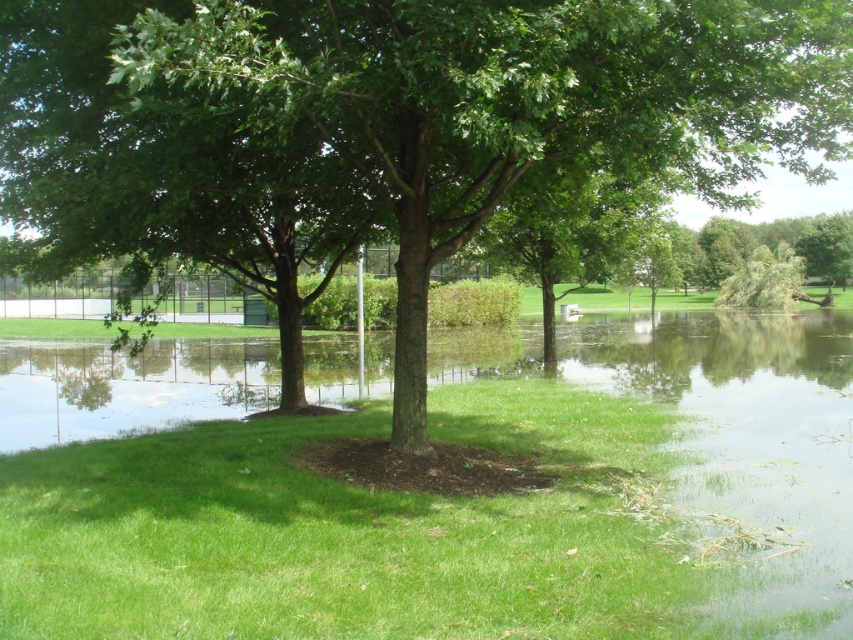
Which is above, green leafy tree at center or green leafy tree at right?

green leafy tree at right

Who is shorter, green leafy tree at center or green leafy tree at right?

Standing shorter between the two is green leafy tree at center.

Is point (752, 154) closer to viewer compared to point (837, 260)?

Yes, it is in front of point (837, 260).

Identify the location of green leafy tree at center. (457, 97).